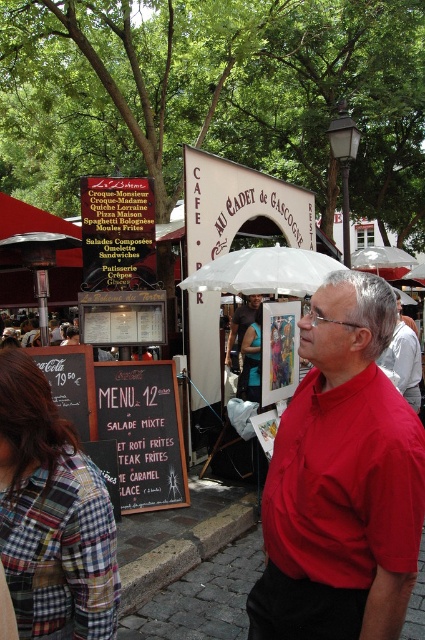
Question: Can you confirm if red smooth shirt at center is wider than matte red shirt at center?

Choices:
 (A) no
 (B) yes

Answer: (B)

Question: Which of the following is the closest to the observer?

Choices:
 (A) matte red shirt at center
 (B) black chalkboard menu at lower left
 (C) red smooth shirt at center
 (D) plaid fabric shirt at lower left

Answer: (C)

Question: Estimate the real-world distances between objects in this image. Which object is closer to the matte red shirt at center?

Choices:
 (A) plaid fabric shirt at lower left
 (B) red matte shirt at center

Answer: (B)

Question: Can you confirm if red smooth shirt at center is positioned to the left of black chalkboard menu at lower left?

Choices:
 (A) no
 (B) yes

Answer: (A)

Question: Is red matte shirt at center to the right of matte red shirt at center from the viewer's perspective?

Choices:
 (A) yes
 (B) no

Answer: (A)

Question: Among these points, which one is farthest from the camera?

Choices:
 (A) [359, 388]
 (B) [99, 420]

Answer: (B)